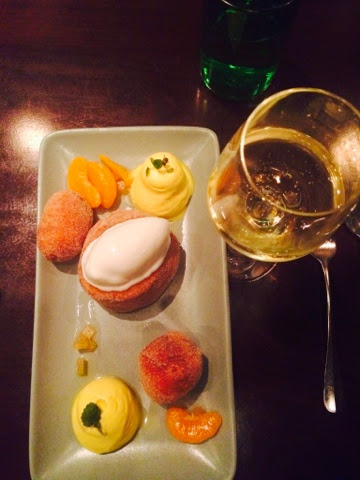
This screenshot has height=480, width=360. I want to click on plate, so click(185, 304).